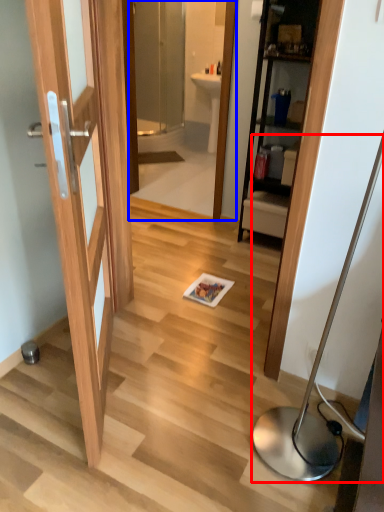
Question: Among these objects, which one is nearest to the camera, table lamp (highlighted by a red box) or mirror (highlighted by a blue box)?

Choices:
 (A) table lamp
 (B) mirror

Answer: (A)